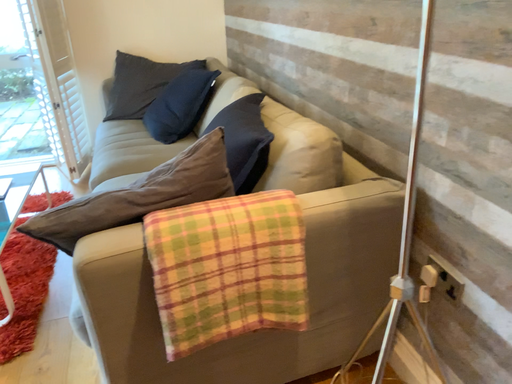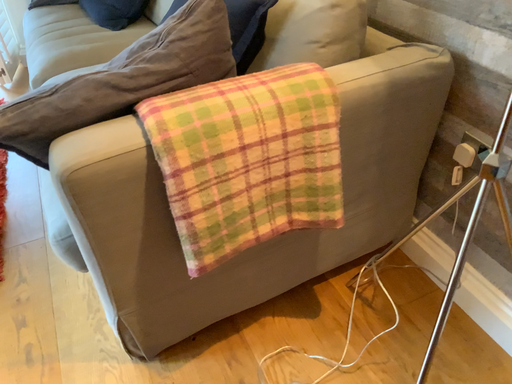
Question: How did the camera likely rotate when shooting the video?

Choices:
 (A) rotated downward
 (B) rotated upward

Answer: (A)